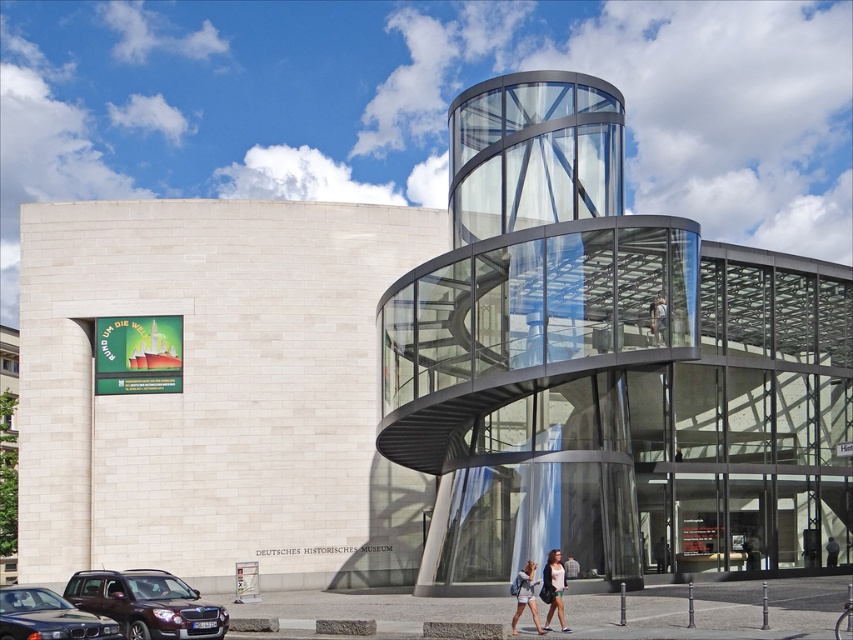
You are a visitor standing in front of the Deutsches Historisches Museum. You notice a matte brown suv at lower left and denim shorts at lower center in the scene. Which object is taller?

The matte brown suv at lower left is taller than the denim shorts at lower center.

You are a visitor standing at the entrance of the Deutsches Historisches Museum. You see a matte brown suv at lower left and a light brown hair at center. Which object is closer to you?

The matte brown suv at lower left is closer to you because it is in front of the light brown hair at center.

You are standing at the entrance of the Deutsches Historisches Museum and see two points marked on the building. The first point is at coordinate point(84, 577) and the second point is at point(527, 600). Which point is closer to you?

Point(527, 600) is closer to you because it is in front of point(84, 577).